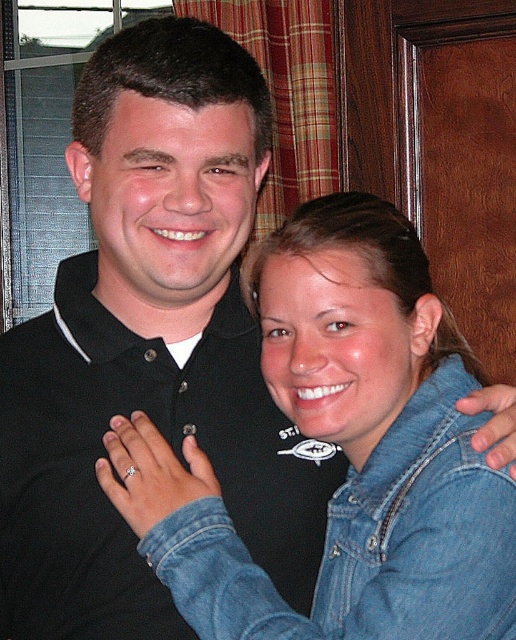
Question: Can you confirm if black cotton polo shirt at center is wider than faded denim jacket at lower right?

Choices:
 (A) yes
 (B) no

Answer: (A)

Question: Which object is farther from the camera taking this photo?

Choices:
 (A) black cotton polo shirt at center
 (B) faded denim jacket at lower right

Answer: (A)

Question: Observing the image, what is the correct spatial positioning of black cotton polo shirt at center in reference to faded denim jacket at lower right?

Choices:
 (A) below
 (B) above

Answer: (B)

Question: Is black cotton polo shirt at center below faded denim jacket at lower right?

Choices:
 (A) yes
 (B) no

Answer: (B)